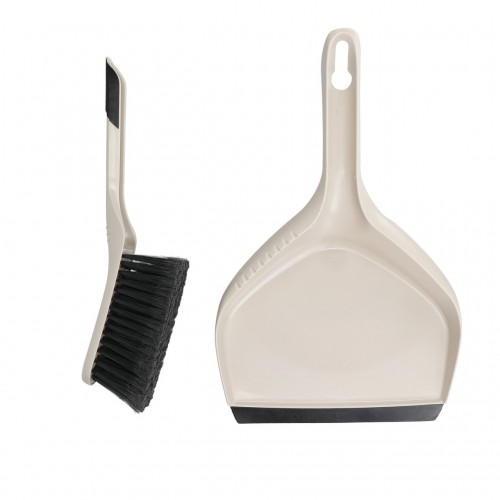
Identify the location of beige handle. Image resolution: width=500 pixels, height=500 pixels. (347, 141).